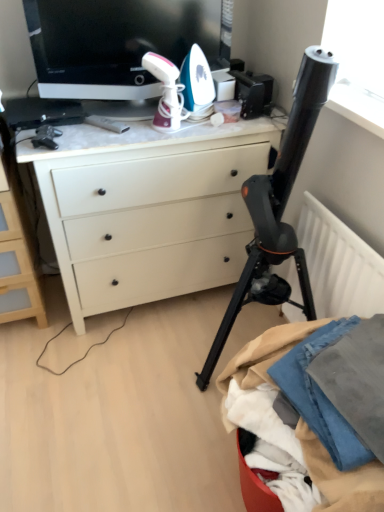
Where is `free space in front of white matte desk at center`? Image resolution: width=384 pixels, height=512 pixels. free space in front of white matte desk at center is located at coordinates coord(117,401).